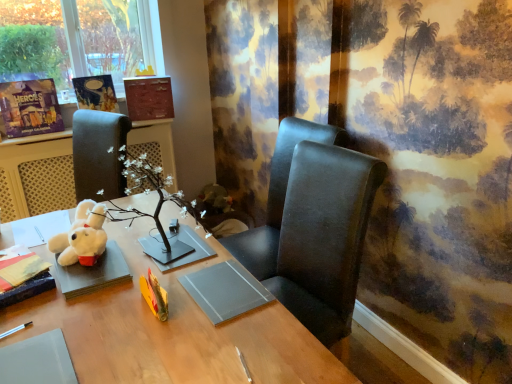
This screenshot has height=384, width=512. What are the coordinates of `vacant area that is in front of white plush toy at lower left` in the screenshot? It's located at (70, 295).